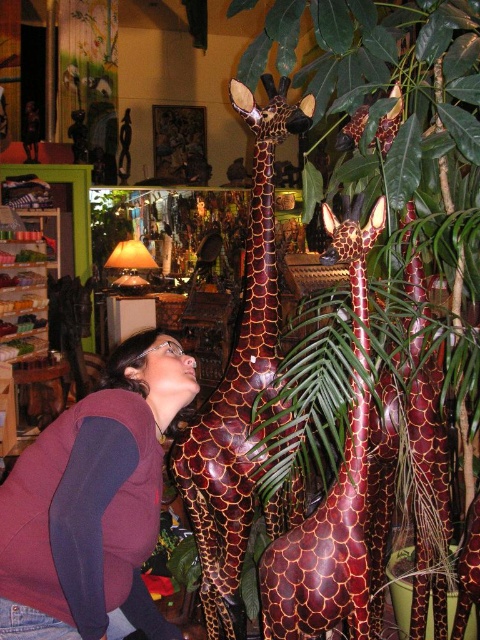
You are a delivery person who needs to place a small package on the green leafy plant at center. The package is 1 meter in length. Can you fit the package on the plant without it hanging off the edge?

The green leafy plant at center is 1.03 meters from camera. Since the package is 1 meter long, it can fit on the plant as the distance from the camera to the plant is slightly larger than the package length.

You are an interior designer planning to rearrange the space. You want to move the maroon sweater at lower left and the shiny brown giraffe at center. Which object is located lower in the image?

The maroon sweater at lower left is positioned under the shiny brown giraffe at center, so it is lower in the image.

You are a delivery person trying to place a small package between the maroon sweater at lower left and the shiny brown giraffe at center. The package is 12 inches long. Can you fit it in the space between them?

The distance between the maroon sweater at lower left and the shiny brown giraffe at center is 12.13 inches. Since the package is 12 inches long, it can fit in the space between them as there is enough room.